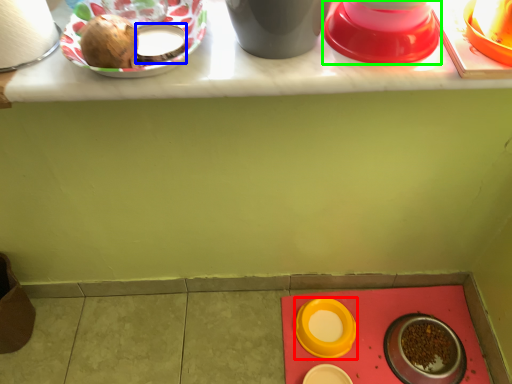
Question: Which object is the closest to the tableware (highlighted by a red box)? Choose among these: tableware (highlighted by a blue box) or tableware (highlighted by a green box).

Choices:
 (A) tableware
 (B) tableware

Answer: (B)